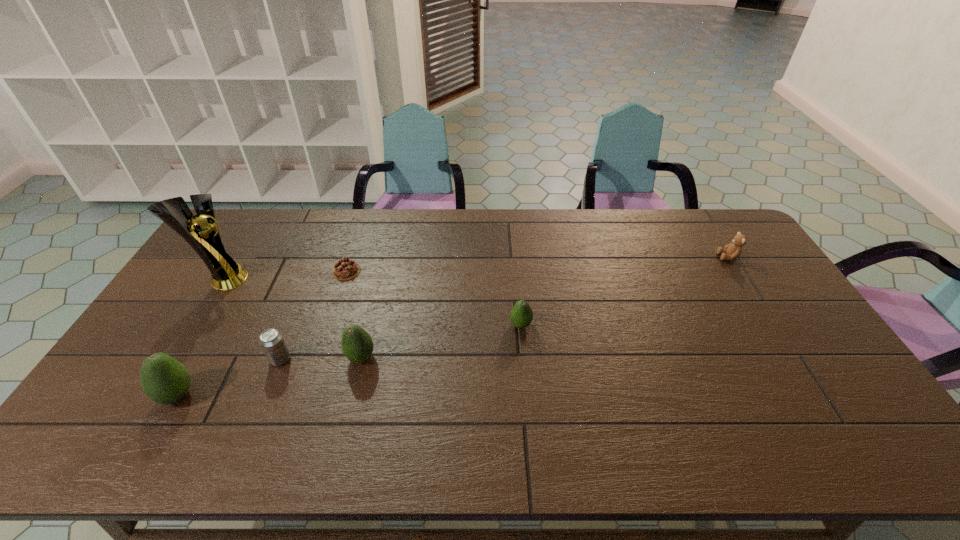
I want to click on the second tallest object, so click(165, 380).

You are a GUI agent. You are given a task and a screenshot of the screen. Output one action in this format:
    pyautogui.click(x=<x>, y=<y>)
    Task: Click on the leftmost avocado
    
    Given the screenshot: What is the action you would take?
    pos(165,380)

Find the location of a particular element. The image size is (960, 540). the second avocado from right to left is located at coordinates (357, 344).

What are the coordinates of `the fifth shortest object` in the screenshot? It's located at (357, 344).

Image resolution: width=960 pixels, height=540 pixels. I want to click on the sixth object from left to right, so click(521, 315).

Locate an element on the screen. The height and width of the screenshot is (540, 960). the farthest avocado is located at coordinates (521, 315).

Identify the location of the fourth object from right to left. Image resolution: width=960 pixels, height=540 pixels. (345, 269).

At what (x,y) coordinates should I click in order to perform the action: click on chocolate cake. Please return your answer as a coordinate pair (x, y). The width and height of the screenshot is (960, 540). Looking at the image, I should click on (345, 269).

In order to click on the rightmost object in this screenshot , I will do (732, 251).

Locate an element on the screen. the tallest object is located at coordinates (226, 274).